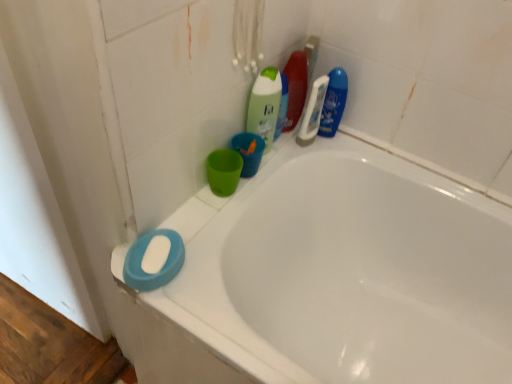
I want to click on free point to the right of white matte soap at lower left, so pos(207,285).